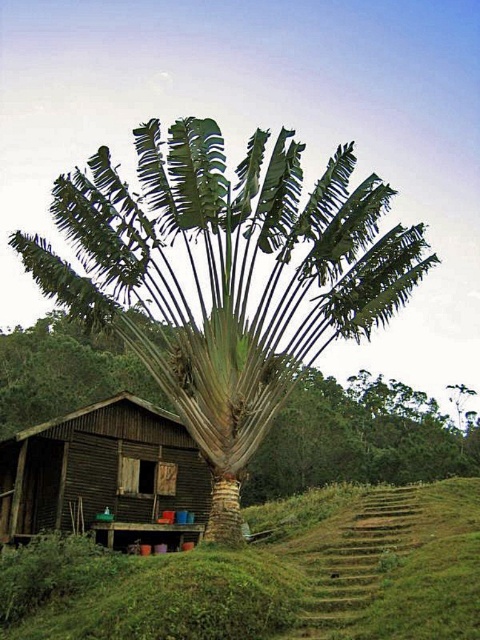
In the scene shown: You are planning to install a sprinkler system between the green leafy banana tree at center and the green leafy palm at center. The sprinkler system requires a minimum distance of 10 meters between the two trees to function properly. Based on the scene, will the sprinkler system work effectively here?

The green leafy banana tree at center and green leafy palm at center are 13.04 meters apart from each other, which exceeds the minimum required distance of 10 meters. Therefore, the sprinkler system will work effectively here.

You are planning to place a new bench in the garden. The bench requires a space wider than the brown wooden hut at lower left. Can the area where the green leafy palm at center is located accommodate the bench?

The green leafy palm at center is wider than the brown wooden hut at lower left, so the area where the green leafy palm at center is located can accommodate the bench since its width surpasses the required space.

You are standing at the point marked as point (259, 436) in the image, which is 11.41 meters away from the camera. You want to walk towards the palm tree in the foreground. Is the palm tree closer to you or farther away than your current position?

The palm tree is closer to you than your current position because the point you are standing at is 11.41 meters away from the camera, and the palm tree dominates the foreground, indicating it is nearer than your location.